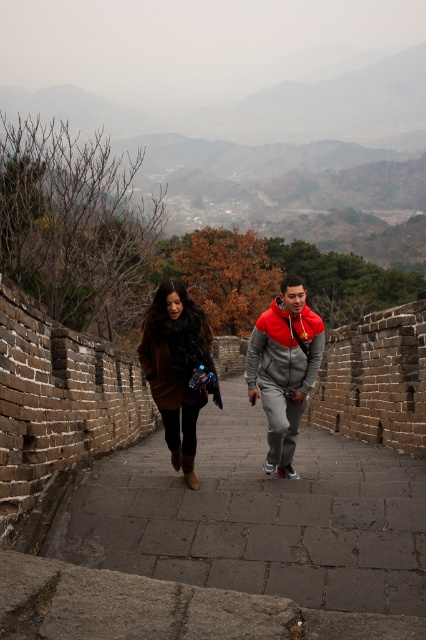
Based on the photo, you are standing on the Great Wall and want to take a photo of the two points marked on the wall. The first point is at coordinate point (216, 404) and the second point is at coordinate point (265, 364). Which point is closer to your camera when taking the photo?

Point (216, 404) is closer to the camera than point (265, 364) because it is further to the camera than the latter according to the description.